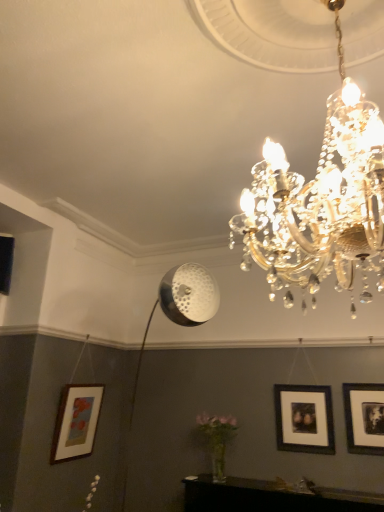
Question: Looking at the image, does black matte picture frame at right, positioned as the 3th picture frame in left-to-right order, seem bigger or smaller compared to wooden matte picture frame at lower left, the 3th picture frame positioned from the right?

Choices:
 (A) big
 (B) small

Answer: (B)

Question: Considering the positions of black matte picture frame at right, positioned as the 3th picture frame in left-to-right order, and wooden matte picture frame at lower left, the 3th picture frame positioned from the right, in the image, is black matte picture frame at right, positioned as the 3th picture frame in left-to-right order, wider or thinner than wooden matte picture frame at lower left, the 3th picture frame positioned from the right,?

Choices:
 (A) wide
 (B) thin

Answer: (B)

Question: Based on their relative distances, which object is nearer to the black matte picture frame at right, positioned as the 3th picture frame in left-to-right order?

Choices:
 (A) black matte picture frame at center right, which appears as the second picture frame when viewed from the right
 (B) wooden matte picture frame at lower left, the 3th picture frame positioned from the right

Answer: (A)

Question: Considering the real-world distances, which object is farthest from the black matte picture frame at center right, acting as the second picture frame starting from the left?

Choices:
 (A) black matte picture frame at right, positioned as the 3th picture frame in left-to-right order
 (B) wooden matte picture frame at lower left, the first picture frame when ordered from left to right

Answer: (B)